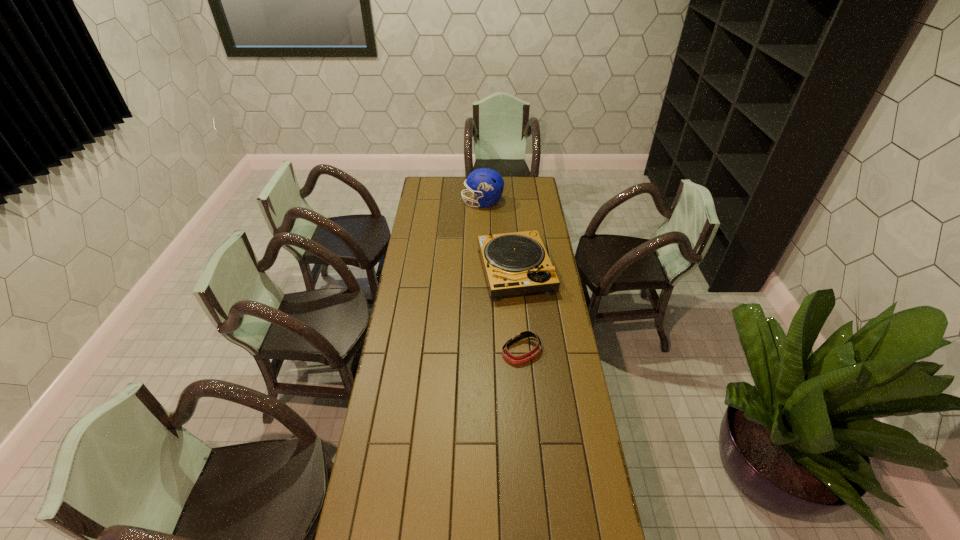
Locate an element on the screen. football helmet is located at coordinates (486, 183).

Identify the location of the farthest object. The width and height of the screenshot is (960, 540). (486, 183).

At what (x,y) coordinates should I click in order to perform the action: click on record player. Please return your answer as a coordinate pair (x, y). Image resolution: width=960 pixels, height=540 pixels. Looking at the image, I should click on tap(516, 263).

Identify the location of the second farthest object. (516, 263).

The height and width of the screenshot is (540, 960). I want to click on the nearest object, so (519, 336).

Locate an element on the screen. This screenshot has width=960, height=540. the shortest object is located at coordinates click(519, 336).

This screenshot has width=960, height=540. I want to click on vacant space located 0.120m on the front-facing side of the tallest object, so click(x=442, y=202).

At what (x,y) coordinates should I click in order to perform the action: click on blank area located on the front-facing side of the tallest object. Please return your answer as a coordinate pair (x, y). The height and width of the screenshot is (540, 960). Looking at the image, I should click on (425, 202).

What are the coordinates of `vacant space situated 0.080m on the front of the record player` in the screenshot? It's located at (519, 316).

Identify the location of vacant position located 0.240m on the back of the shortest object. (517, 298).